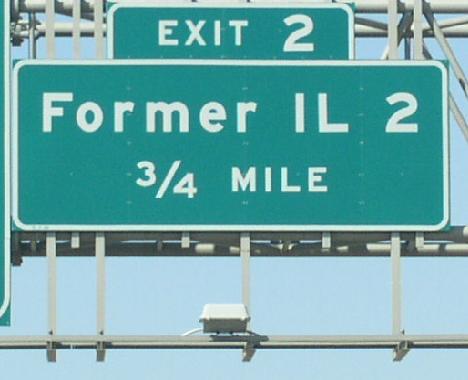
At what (x,y) coordinates should I click in order to perform the action: click on brackets. Please return your answer as a coordinate pair (x, y). The image size is (468, 380). Looking at the image, I should click on (403, 347), (245, 351), (102, 347), (50, 353).